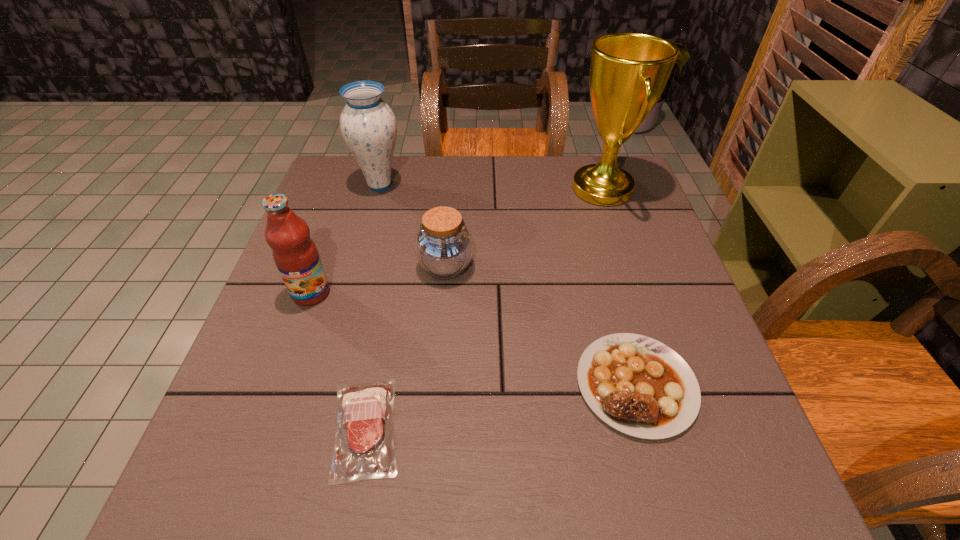
Find the location of a particular element. The width and height of the screenshot is (960, 540). vacant space located by the handles of the award is located at coordinates (479, 188).

Where is `free space located 0.060m on the left of the vase`? This screenshot has width=960, height=540. free space located 0.060m on the left of the vase is located at coordinates (334, 185).

You are a GUI agent. You are given a task and a screenshot of the screen. Output one action in this format:
    pyautogui.click(x=<x>, y=<y>)
    Task: Click on the vacant space located on the front label of the fruit juice
    
    Given the screenshot: What is the action you would take?
    [x=300, y=326]

The height and width of the screenshot is (540, 960). Find the location of `free spot located on the front of the jar`. free spot located on the front of the jar is located at coordinates (438, 365).

Where is `vacant region located on the left of the taller steak`? The width and height of the screenshot is (960, 540). vacant region located on the left of the taller steak is located at coordinates point(517,384).

Locate an element on the screen. vacant space located 0.130m on the right of the left steak is located at coordinates (479, 428).

Where is `award that is at the far edge`? The image size is (960, 540). award that is at the far edge is located at coordinates [628, 71].

Where is `vase positioned at the far edge`? The width and height of the screenshot is (960, 540). vase positioned at the far edge is located at coordinates (368, 125).

Identify the location of object positioned at the near edge. This screenshot has height=540, width=960. tap(364, 448).

Where is `vase located at the left edge`? The width and height of the screenshot is (960, 540). vase located at the left edge is located at coordinates (368, 125).